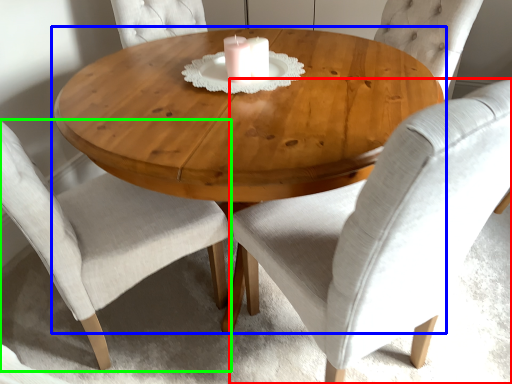
Question: Based on their relative distances, which object is nearer to chair (highlighted by a red box)? Choose from coffee table (highlighted by a blue box) and chair (highlighted by a green box).

Choices:
 (A) coffee table
 (B) chair

Answer: (A)